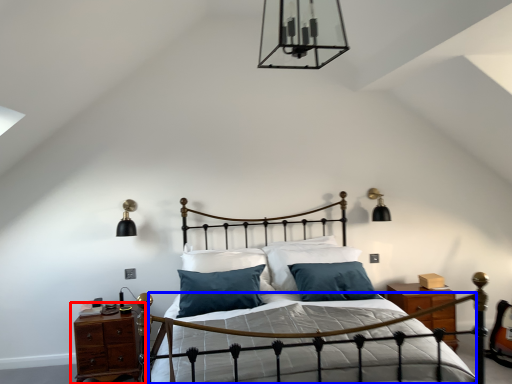
Question: Which point is further to the camera, nightstand (highlighted by a red box) or bed frame (highlighted by a blue box)?

Choices:
 (A) nightstand
 (B) bed frame

Answer: (A)